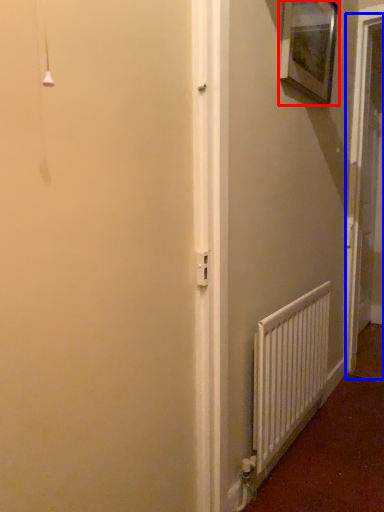
Question: Which object appears closest to the camera in this image, picture frame (highlighted by a red box) or screen door (highlighted by a blue box)?

Choices:
 (A) picture frame
 (B) screen door

Answer: (A)